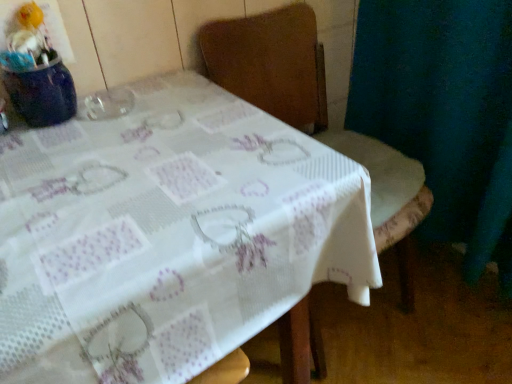
Where is `vacant region above white printed fabric at center (from a real-world perspective)`? vacant region above white printed fabric at center (from a real-world perspective) is located at coordinates (134, 163).